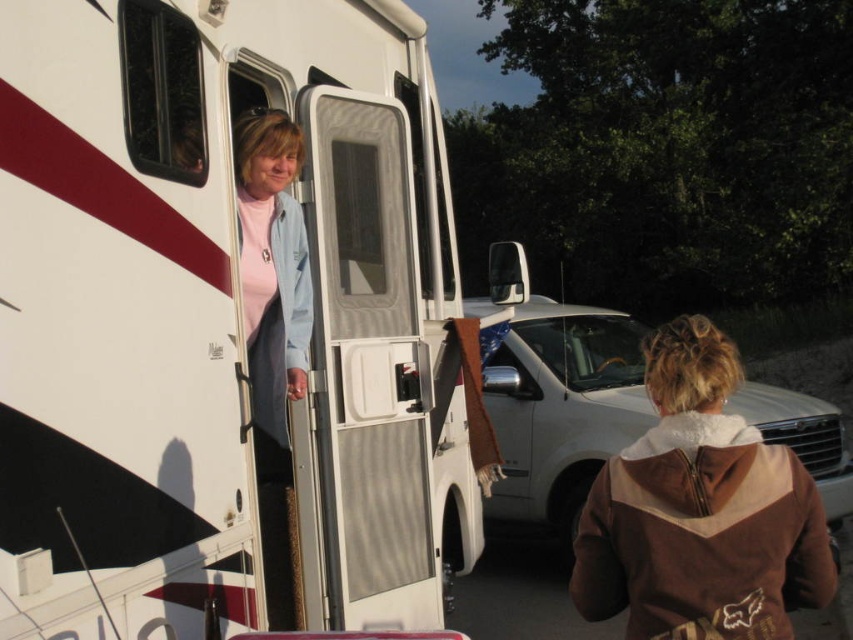
Does point (202, 68) come behind point (759, 556)?

Yes, it is behind point (759, 556).

Does white matte trailer truck at center have a larger size compared to brown fleece jacket at upper right?

Yes.

Is point (79, 579) closer to viewer compared to point (726, 346)?

Yes, point (79, 579) is closer to viewer.

At what (x,y) coordinates should I click in order to perform the action: click on white matte trailer truck at center. Please return your answer as a coordinate pair (x, y). The width and height of the screenshot is (853, 640). Looking at the image, I should click on click(x=227, y=323).